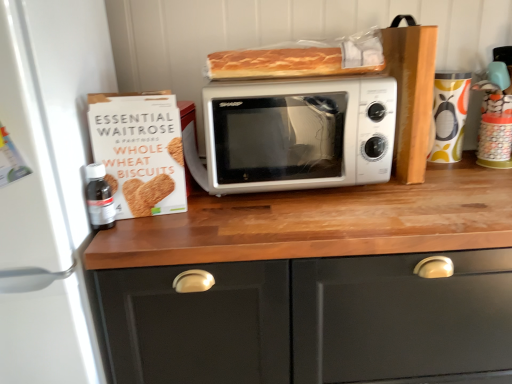
Image resolution: width=512 pixels, height=384 pixels. In order to click on vacant area on top of matte wood cabinet at center (from a real-world perspective) in this screenshot , I will do `click(366, 198)`.